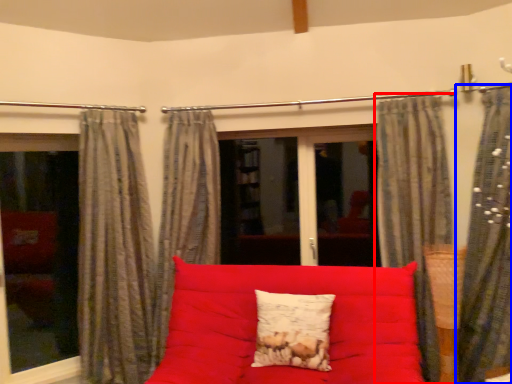
Question: Which of the following is the farthest to the observer, curtain (highlighted by a red box) or curtain (highlighted by a blue box)?

Choices:
 (A) curtain
 (B) curtain

Answer: (A)